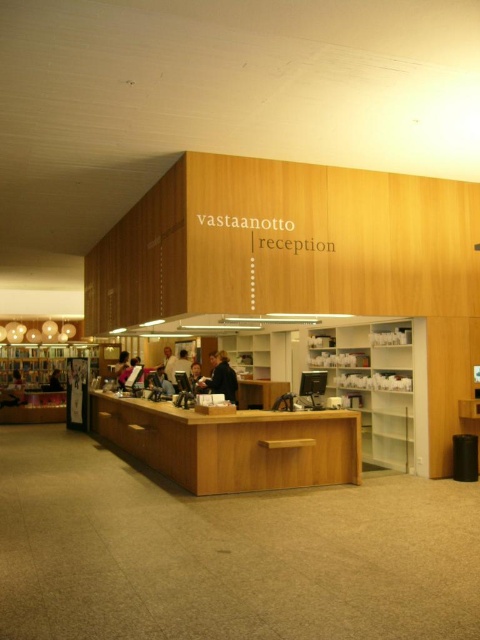
You are standing at the entrance of the library and notice a dark brown leather jacket at center. Where is the jacket in relation to the reception desk?

The dark brown leather jacket at center is located at point (196, 378), which is to the right of the reception desk.